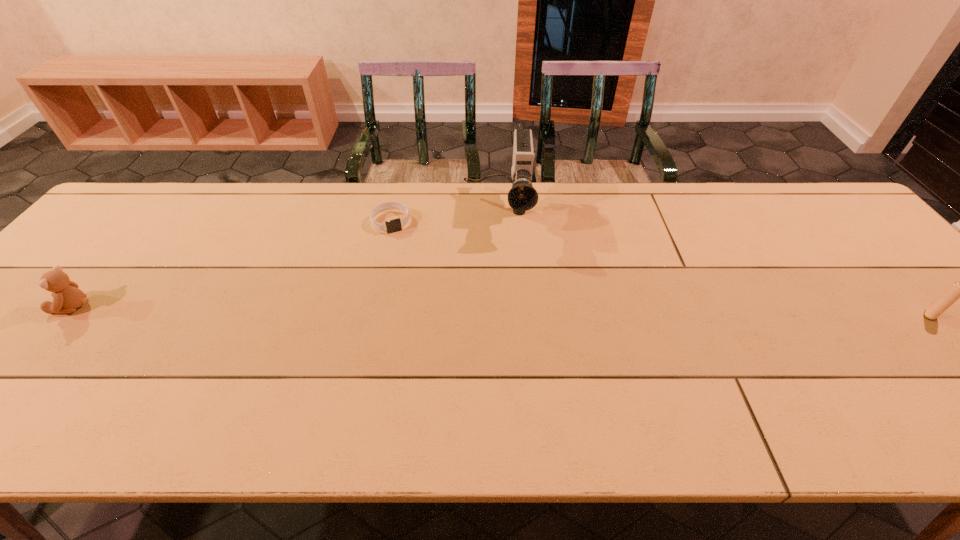
The image size is (960, 540). Identify the location of free space at the far right corner. (834, 213).

Locate an element on the screen. The width and height of the screenshot is (960, 540). free space between the rightmost object and the second object from left to right is located at coordinates (660, 268).

Find the location of `empty space that is in between the wristband and the tallest object`. empty space that is in between the wristband and the tallest object is located at coordinates click(444, 217).

The width and height of the screenshot is (960, 540). What are the coordinates of `free area in between the third object from right to left and the leftmost object` in the screenshot? It's located at [232, 264].

Locate an element on the screen. free point between the igniter and the teddy bear is located at coordinates (501, 310).

The height and width of the screenshot is (540, 960). Find the location of `empty space that is in between the leftmost object and the camcorder`. empty space that is in between the leftmost object and the camcorder is located at coordinates (285, 259).

Where is `unoccupied position between the teddy bear and the tallest object`? Image resolution: width=960 pixels, height=540 pixels. unoccupied position between the teddy bear and the tallest object is located at coordinates (285, 259).

Locate an element on the screen. The height and width of the screenshot is (540, 960). free space between the wristband and the igniter is located at coordinates (660, 268).

I want to click on free area in between the third object from left to right and the rightmost object, so click(x=713, y=263).

I want to click on free space that is in between the third object from left to right and the igniter, so pos(713,263).